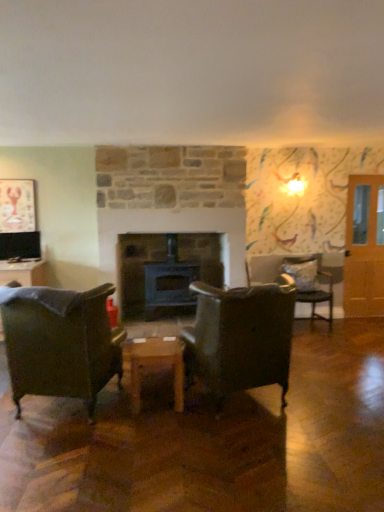
Question: In terms of height, does metallic lobster picture frame at upper left look taller or shorter compared to translucent wooden door at right?

Choices:
 (A) short
 (B) tall

Answer: (A)

Question: Is metallic lobster picture frame at upper left in front of or behind translucent wooden door at right in the image?

Choices:
 (A) front
 (B) behind

Answer: (A)

Question: Which object is positioned farthest from the translucent wooden door at right?

Choices:
 (A) matte black tv at left
 (B) leather at center, the second chair when ordered from right to left
 (C) metallic lobster picture frame at upper left
 (D) black matte fireplace at center
 (E) wooden table at center

Answer: (C)

Question: Based on their relative distances, which object is nearer to the matte black tv at left?

Choices:
 (A) leather at center, which appears as the 1th chair when viewed from the front
 (B) leather armchair at left, which is the 1th chair in left-to-right order
 (C) metallic lobster picture frame at upper left
 (D) gray fabric pillow at right
 (E) wooden table at center

Answer: (C)